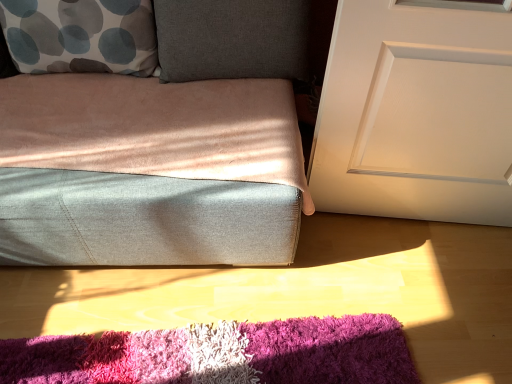
Image resolution: width=512 pixels, height=384 pixels. In order to click on free area in between white matte door at right and shaggy multicolor rug at lower center in this screenshot , I will do `click(327, 282)`.